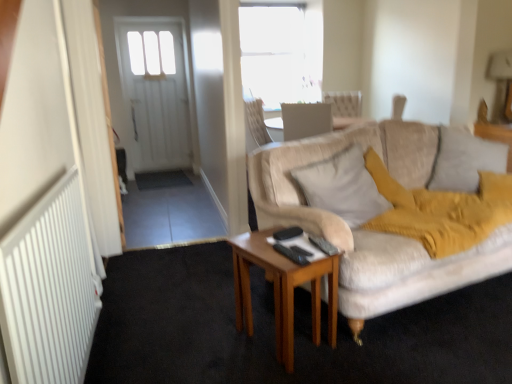
The height and width of the screenshot is (384, 512). Find the location of `free location to the left of wooden table at center`. free location to the left of wooden table at center is located at coordinates (204, 344).